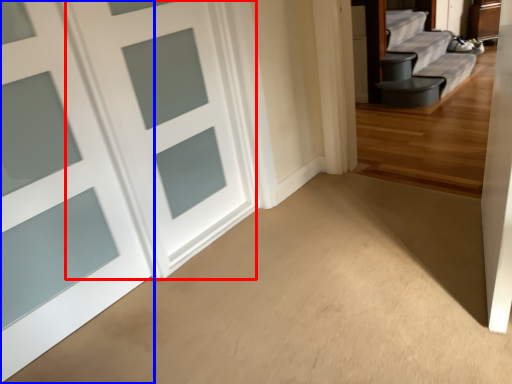
Question: Which object is closer to the camera taking this photo, door (highlighted by a red box) or door (highlighted by a blue box)?

Choices:
 (A) door
 (B) door

Answer: (B)